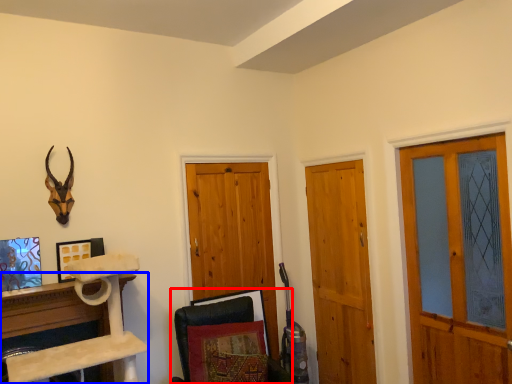
Question: Which object appears farthest to the camera in this image, swivel chair (highlighted by a red box) or furniture (highlighted by a blue box)?

Choices:
 (A) swivel chair
 (B) furniture

Answer: (B)